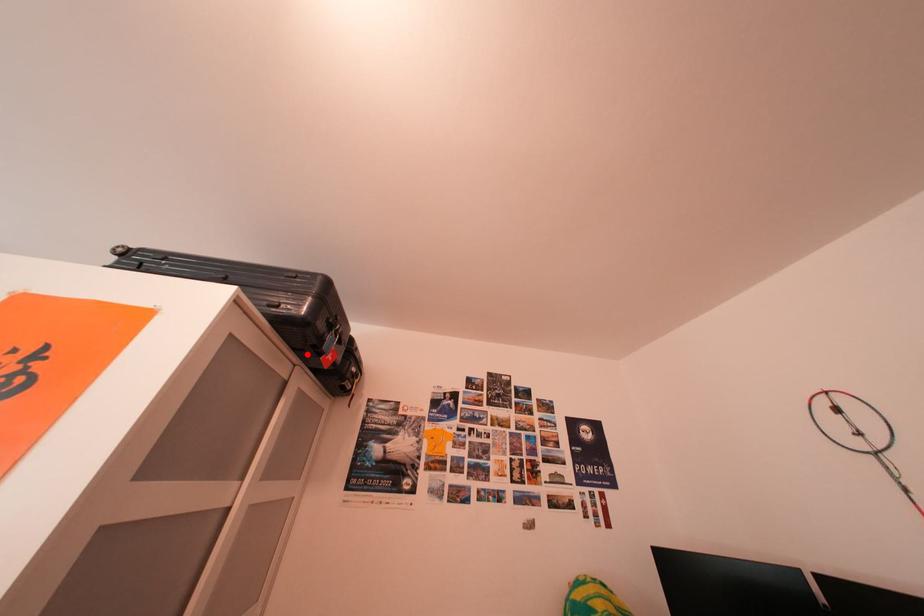
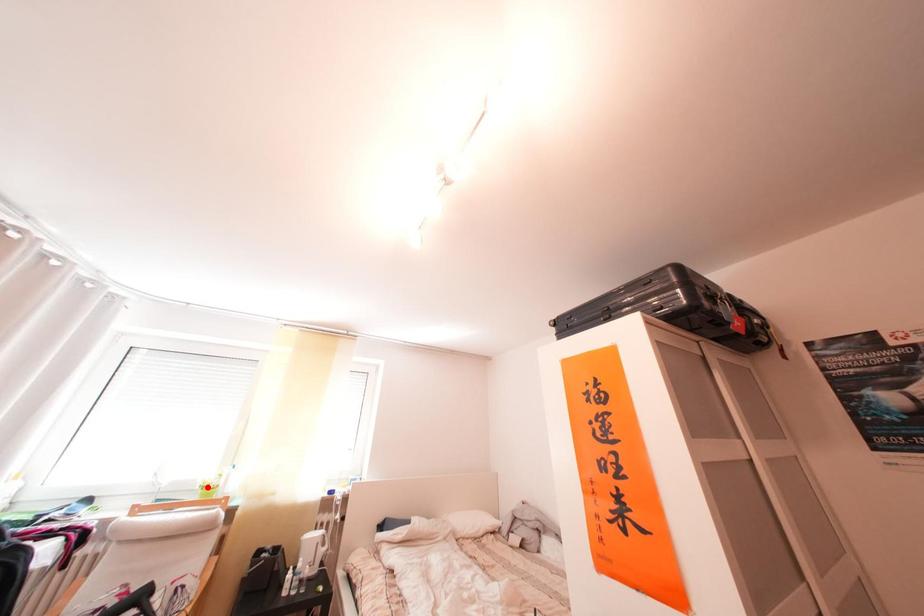
I am providing you with two images of the same scene from different viewpoints. A red point is marked on the first image and another point is marked on the second image. Does the point marked in image1 correspond to the same location as the one in image2?

No